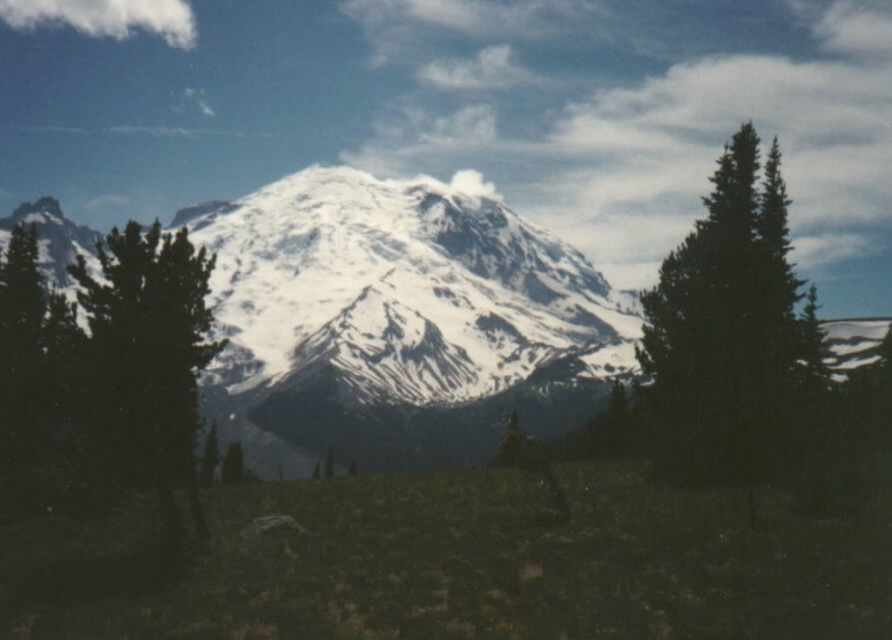
You are standing at point (109,358) in the image. What object is located at that point?

The green matte tree at left is located at point (109,358).